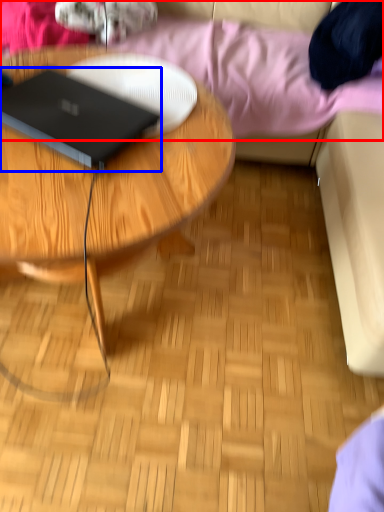
Question: Which of the following is the closest to the observer, bedding (highlighted by a red box) or laptop (highlighted by a blue box)?

Choices:
 (A) bedding
 (B) laptop

Answer: (B)